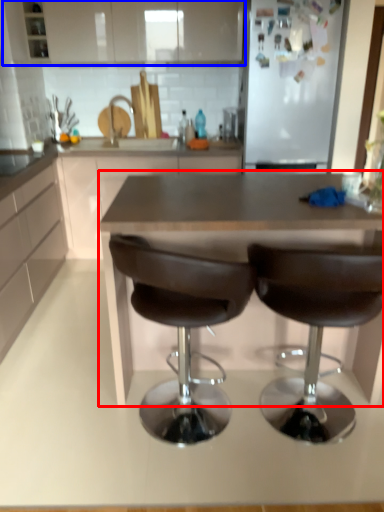
Question: Which object appears closest to the camera in this image, table (highlighted by a red box) or cabinetry (highlighted by a blue box)?

Choices:
 (A) table
 (B) cabinetry

Answer: (A)